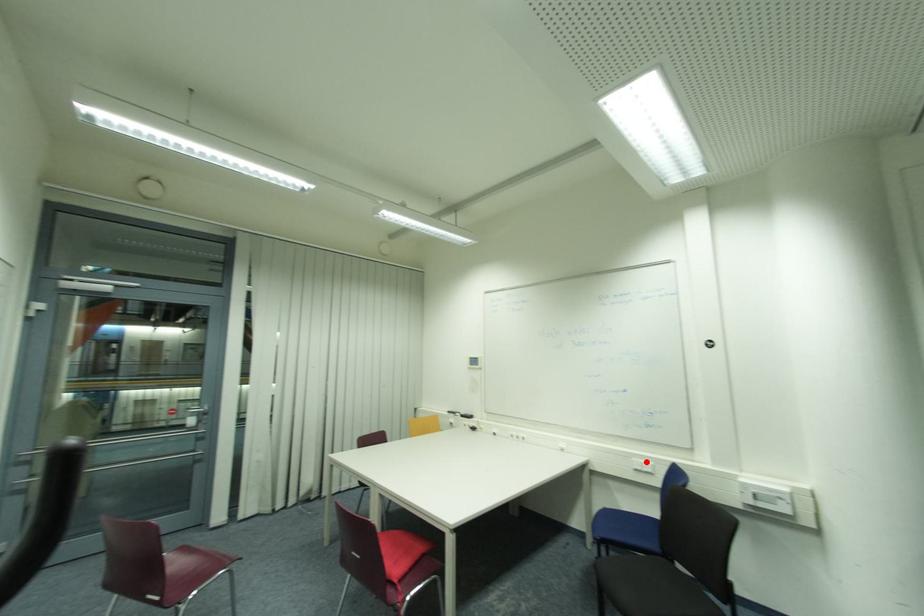
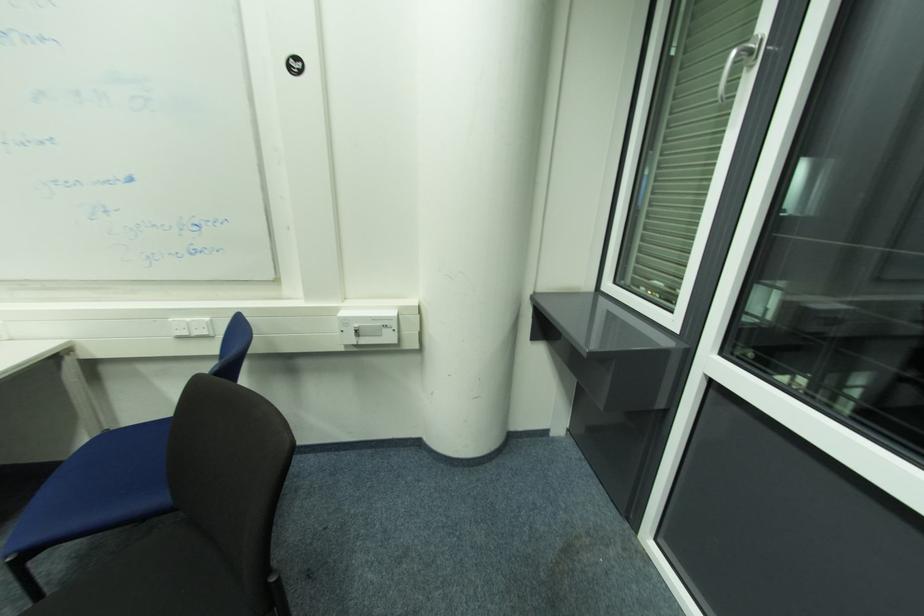
Question: I am providing you with two images of the same scene from different viewpoints. A red point is shown in image1. For the corresponding object point in image2, is it positioned nearer or farther from the camera?

Choices:
 (A) Nearer
 (B) Farther

Answer: (A)